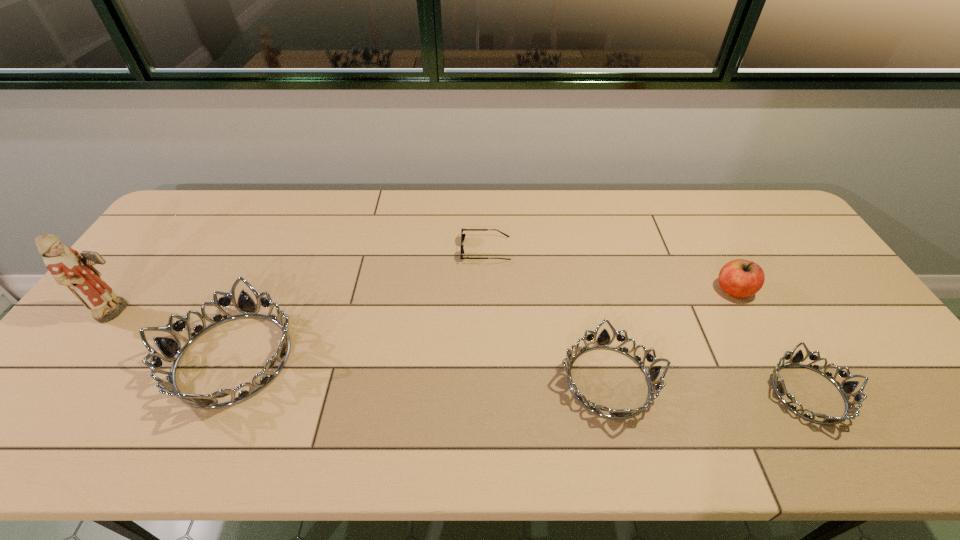
I want to click on object that is the fifth nearest to the leftmost tiara, so click(x=846, y=387).

Locate which object ranks fourth in proximity to the second tiara from right to left. Please provide its 2D coordinates. Your answer should be formatted as a tuple, i.e. [(x, y)], where the tuple contains the x and y coordinates of a point satisfying the conditions above.

[(171, 350)]

Locate which tiara is the second closest to the third object from left to right. Please provide its 2D coordinates. Your answer should be formatted as a tuple, i.e. [(x, y)], where the tuple contains the x and y coordinates of a point satisfying the conditions above.

[(171, 350)]

In order to click on tiara that stands as the closest to the leftmost tiara in this screenshot , I will do `click(603, 341)`.

At what (x,y) coordinates should I click in order to perform the action: click on vacant space that satisfies the following two spatial constraints: 1. on the front side of the apple; 2. on the front-facing side of the leftmost tiara. Please return your answer as a coordinate pair (x, y). This screenshot has width=960, height=540. Looking at the image, I should click on (771, 359).